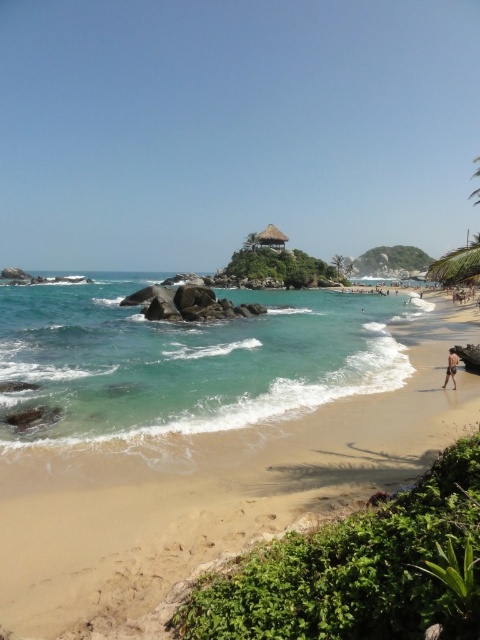
You are standing on the beach and see the clear blue water at center and the brown sandy person at lower right. Which object is closer to you?

The clear blue water at center is closer to you because it is in front of the brown sandy person at lower right.

You are standing on the sandy beach at lower left and want to reach the brown thatched hut at center. Which direction should you walk to get there?

You should walk towards the center from the sandy beach at lower left to reach the brown thatched hut at center because the sandy beach at lower left is much taller than the brown thatched hut at center, so the elevation decreases towards the center.